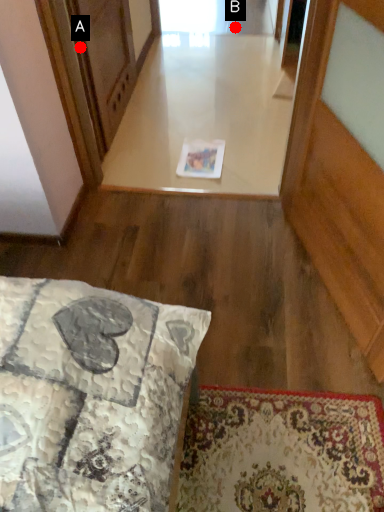
Question: Two points are circled on the image, labeled by A and B beside each circle. Which point is further to the camera?

Choices:
 (A) A is further
 (B) B is further

Answer: (B)